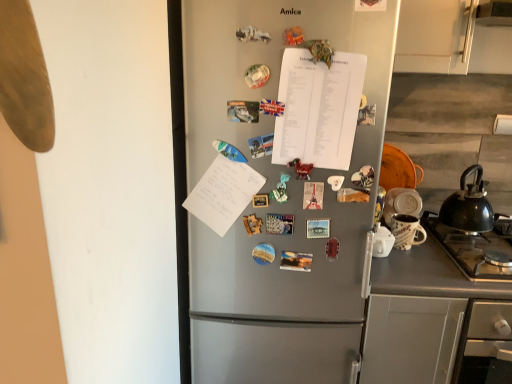
The image size is (512, 384). Find the location of `vacant area that is in front of matte ceramic mug at right`. vacant area that is in front of matte ceramic mug at right is located at coordinates (417, 271).